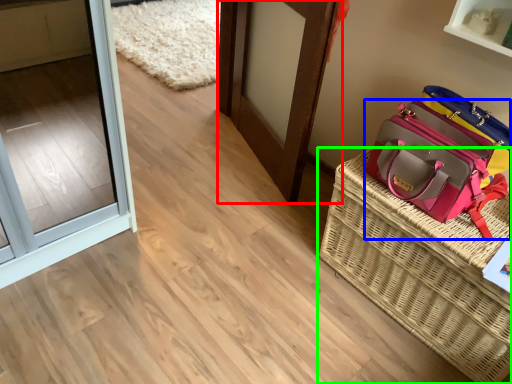
Question: Which is farther away from door (highlighted by a red box)? handbag (highlighted by a blue box) or picnic basket (highlighted by a green box)?

Choices:
 (A) handbag
 (B) picnic basket

Answer: (B)